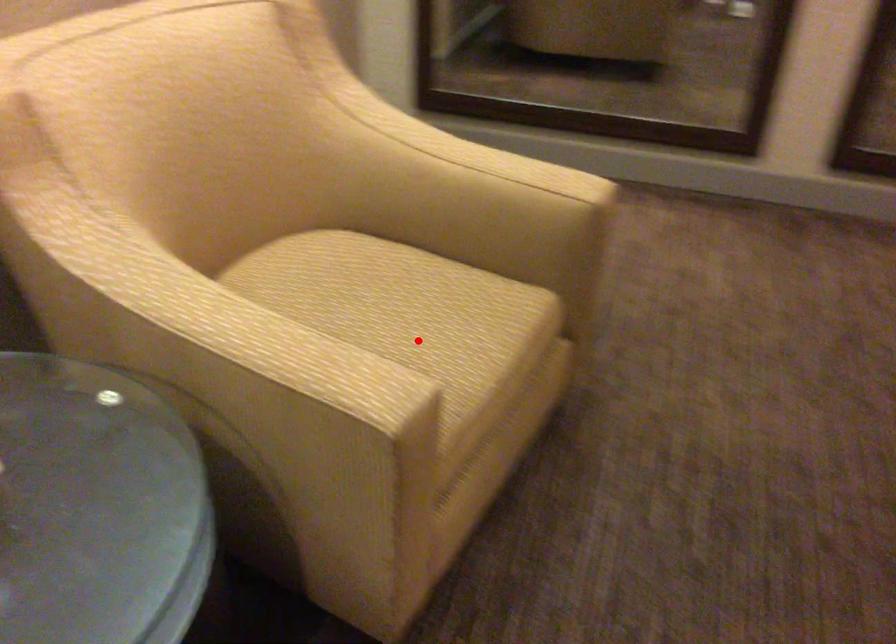
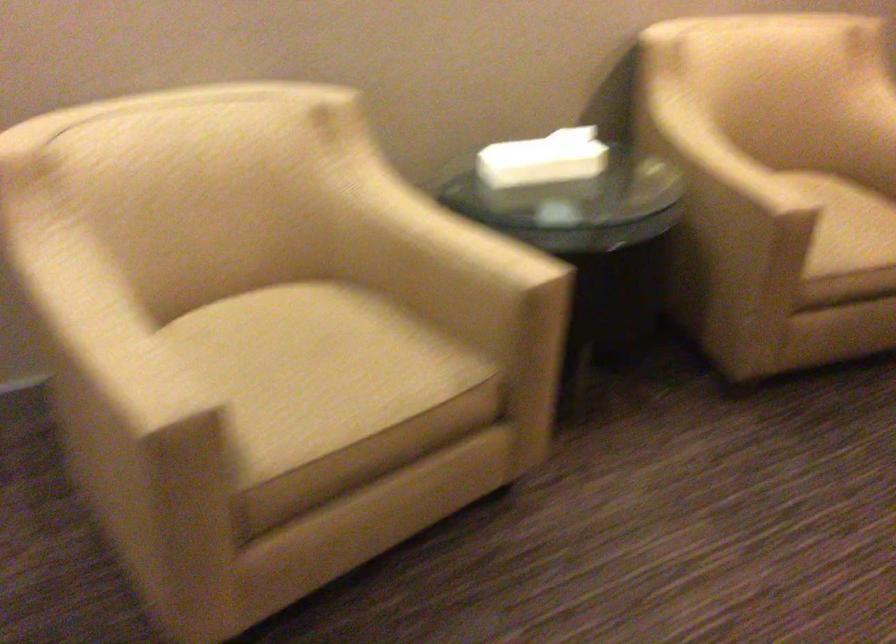
Question: A red point is marked in image1. In image2, is the corresponding 3D point closer to the camera or farther? Reply with the corresponding letter.

Choices:
 (A) The corresponding 3D point is closer.
 (B) The corresponding 3D point is farther.

Answer: (B)